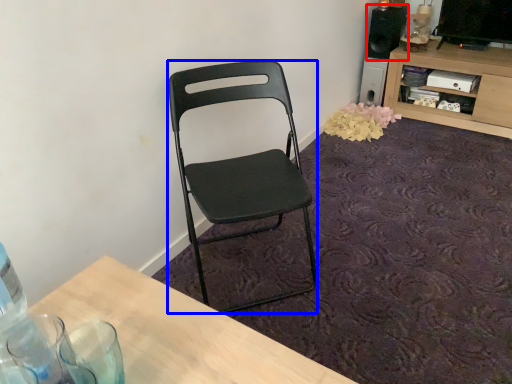
Question: Which object is closer to the camera taking this photo, loudspeaker (highlighted by a red box) or chair (highlighted by a blue box)?

Choices:
 (A) loudspeaker
 (B) chair

Answer: (B)